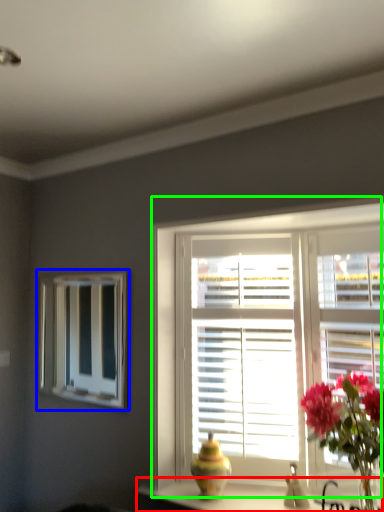
Question: Which object is the closest to the counter top (highlighted by a red box)? Choose among these: bay window (highlighted by a blue box) or window (highlighted by a green box).

Choices:
 (A) bay window
 (B) window

Answer: (B)